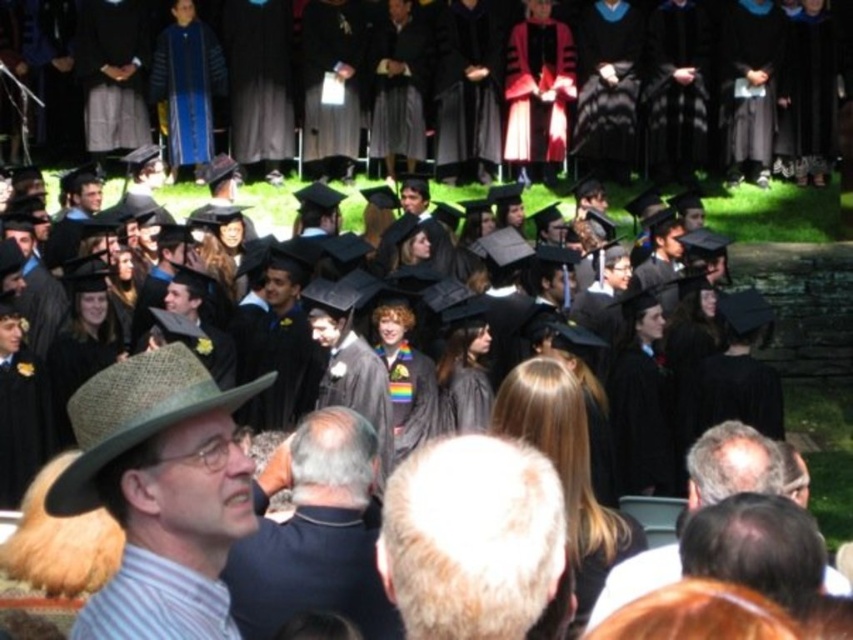
Question: Which point is farther from the camera taking this photo?

Choices:
 (A) (740, 428)
 (B) (306, 588)
 (C) (135, 532)

Answer: (A)

Question: Which point appears closest to the camera in this image?

Choices:
 (A) (132, 506)
 (B) (498, 637)
 (C) (695, 452)

Answer: (B)

Question: Can you confirm if white hair at center is thinner than dark blue shirt at center?

Choices:
 (A) no
 (B) yes

Answer: (A)

Question: Among these points, which one is farthest from the camera?

Choices:
 (A) (196, 376)
 (B) (666, 579)

Answer: (B)

Question: Observing the image, what is the correct spatial positioning of brown straw hat at left in reference to gray hair at center?

Choices:
 (A) right
 (B) left

Answer: (B)

Question: Is brown straw hat at left to the right of gray hair at center from the viewer's perspective?

Choices:
 (A) no
 (B) yes

Answer: (A)